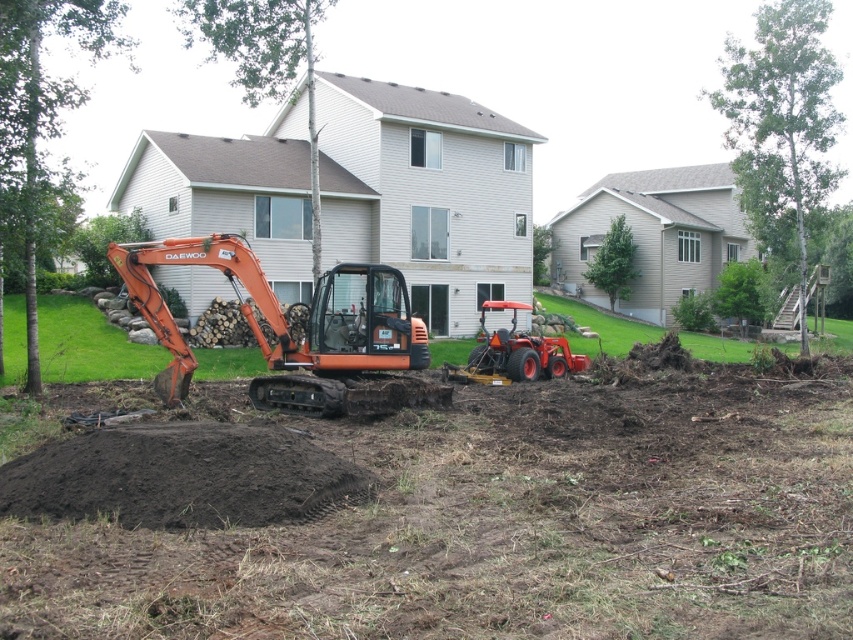
You are a construction worker who needs to move a heavy beam from the orange rubber excavator at center to the orange rubber tractor at center. The beam is 8 meters long. Can you safely place the beam between them without it touching the ground?

The orange rubber excavator at center and orange rubber tractor at center are 7.92 meters apart. Since the beam is 8 meters long, it would extend beyond the distance between them, making it impossible to place the beam between them without it touching the ground.

You are a construction worker who needs to move the orange rubber excavator at center to a new location. However, you must ensure that it doesn not get stuck in the dark brown soil at center. Based on the scene description, what should you be cautious about when moving the excavator?

The orange rubber excavator at center is bigger than the dark brown soil at center, so you should be cautious about the soil being insufficient to support the excavator, potentially causing it to sink or get stuck.